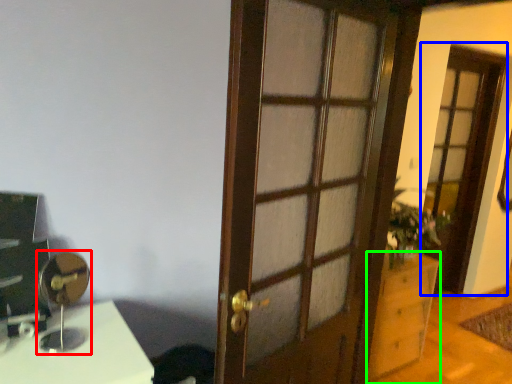
Question: Which object is the farthest from table lamp (highlighted by a red box)? Choose among these: screen door (highlighted by a blue box) or cabinetry (highlighted by a green box).

Choices:
 (A) screen door
 (B) cabinetry

Answer: (A)